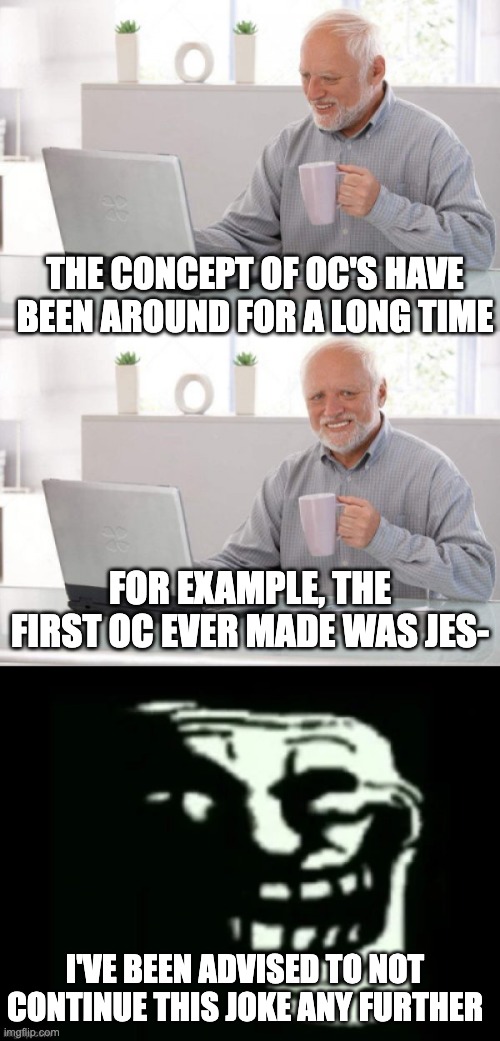
At what (x,y) coordinates should I click in order to perform the action: click on laptop. Please return your answer as a coordinate pair (x, y). Looking at the image, I should click on (133, 179), (139, 518).